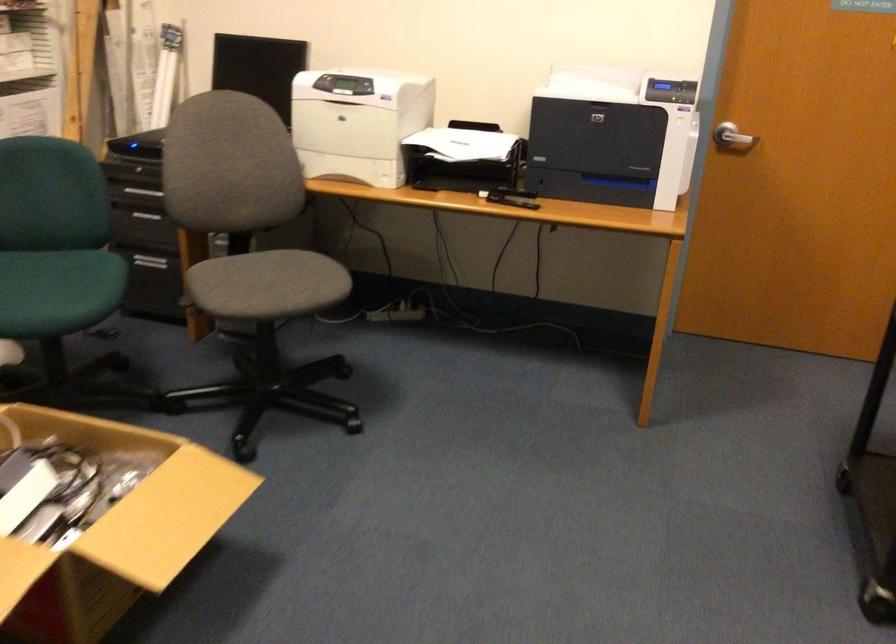
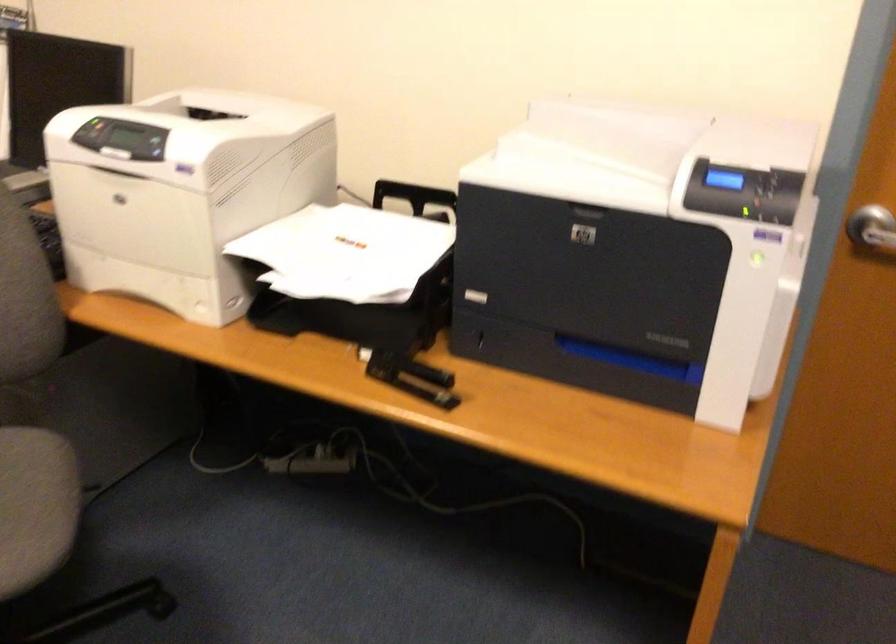
Locate, in the second image, the point that corresponds to pixel 321 269 in the first image.

(35, 506)